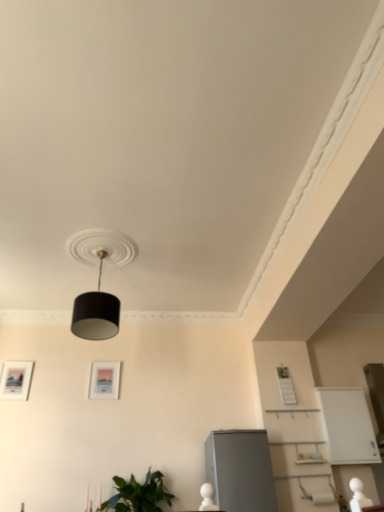
Question: Is matte black picture frame at left, which is counted as the 1th picture frame, starting from the left, located outside green leafy plant at lower left?

Choices:
 (A) yes
 (B) no

Answer: (A)

Question: Can you confirm if matte black picture frame at left, which appears as the 3th picture frame when viewed from the right, is smaller than green leafy plant at lower left?

Choices:
 (A) no
 (B) yes

Answer: (B)

Question: Does matte black picture frame at left, which is counted as the 1th picture frame, starting from the left, have a lesser width compared to green leafy plant at lower left?

Choices:
 (A) yes
 (B) no

Answer: (A)

Question: From the image's perspective, is matte black picture frame at left, which is counted as the 1th picture frame, starting from the left, under green leafy plant at lower left?

Choices:
 (A) no
 (B) yes

Answer: (A)

Question: Can you confirm if matte black picture frame at left, which appears as the 3th picture frame when viewed from the right, is shorter than green leafy plant at lower left?

Choices:
 (A) no
 (B) yes

Answer: (A)

Question: Visually, is black matte lampshade at center positioned to the left or to the right of matte white picture frame at center, placed as the second picture frame when sorted from left to right?

Choices:
 (A) right
 (B) left

Answer: (A)

Question: Is black matte lampshade at center inside or outside of matte white picture frame at center, the second picture frame positioned from the right?

Choices:
 (A) outside
 (B) inside

Answer: (A)

Question: Considering the positions of black matte lampshade at center and matte white picture frame at center, placed as the second picture frame when sorted from left to right, in the image, is black matte lampshade at center bigger or smaller than matte white picture frame at center, placed as the second picture frame when sorted from left to right,?

Choices:
 (A) small
 (B) big

Answer: (B)

Question: Considering the positions of black matte lampshade at center and matte white picture frame at center, the second picture frame positioned from the right, in the image, is black matte lampshade at center wider or thinner than matte white picture frame at center, the second picture frame positioned from the right,?

Choices:
 (A) wide
 (B) thin

Answer: (A)

Question: Considering the positions of point (82, 321) and point (31, 368), is point (82, 321) closer or farther from the camera than point (31, 368)?

Choices:
 (A) farther
 (B) closer

Answer: (B)

Question: In the image, is black matte lampshade at center positioned in front of or behind matte black picture frame at left, which is counted as the 1th picture frame, starting from the left?

Choices:
 (A) front
 (B) behind

Answer: (A)

Question: From a real-world perspective, is black matte lampshade at center positioned above or below matte black picture frame at left, which is counted as the 1th picture frame, starting from the left?

Choices:
 (A) above
 (B) below

Answer: (A)

Question: Is black matte lampshade at center bigger or smaller than matte black picture frame at left, which is counted as the 1th picture frame, starting from the left?

Choices:
 (A) small
 (B) big

Answer: (B)

Question: From the image's perspective, is black matte lampshade at center positioned above or below white matte picture frame at upper right, positioned as the 1th picture frame in right-to-left order?

Choices:
 (A) above
 (B) below

Answer: (A)

Question: Is black matte lampshade at center inside the boundaries of white matte picture frame at upper right, which is counted as the third picture frame, starting from the left, or outside?

Choices:
 (A) inside
 (B) outside

Answer: (B)